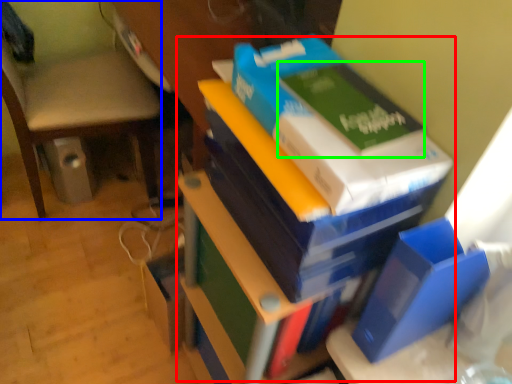
Question: Which is farther away from bookcase (highlighted by a red box)? chair (highlighted by a blue box) or paperback book (highlighted by a green box)?

Choices:
 (A) chair
 (B) paperback book

Answer: (A)